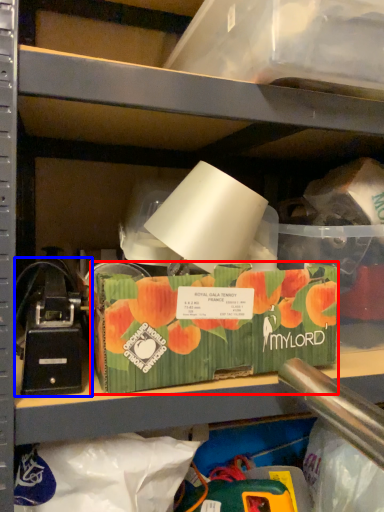
Question: Which object appears closest to the camera in this image, storage box (highlighted by a red box) or toy (highlighted by a blue box)?

Choices:
 (A) storage box
 (B) toy

Answer: (B)